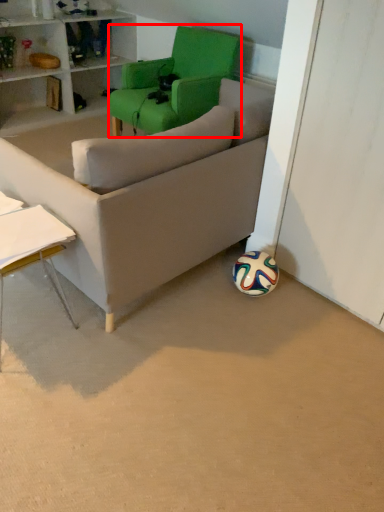
Question: In this image, where is chair (annotated by the red box) located relative to table?

Choices:
 (A) left
 (B) right

Answer: (B)